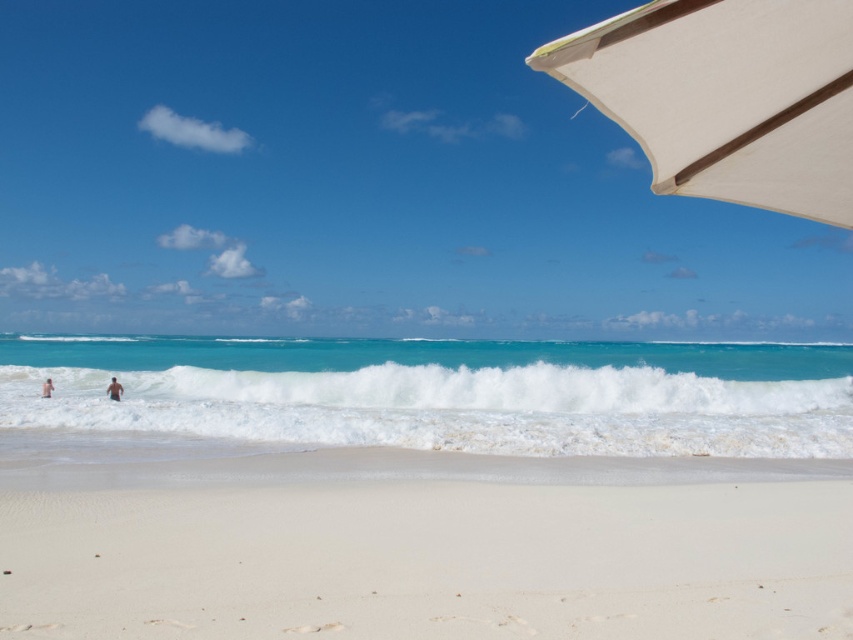
You are standing on the white sandy beach at lower center and want to see the blurred skin person at lower left. Can you see them clearly from your position?

The blurred skin person at lower left is shorter than the white sandy beach at lower center, so you might not be able to see them clearly from your position.

You are standing on the white sandy beach at lower center and want to reach the skinny man at left. Which direction should you walk to get closer to him?

Since the white sandy beach at lower center is in front of the skinny man at left, you should walk forward towards the direction of the skinny man at left to get closer to him.

You are standing on the white sandy beach at lower center and want to reach the blurred skin person at lower left. Which direction should you move to get closer to them?

Since the white sandy beach at lower center is located below the blurred skin person at lower left, you should move upward to reach them.